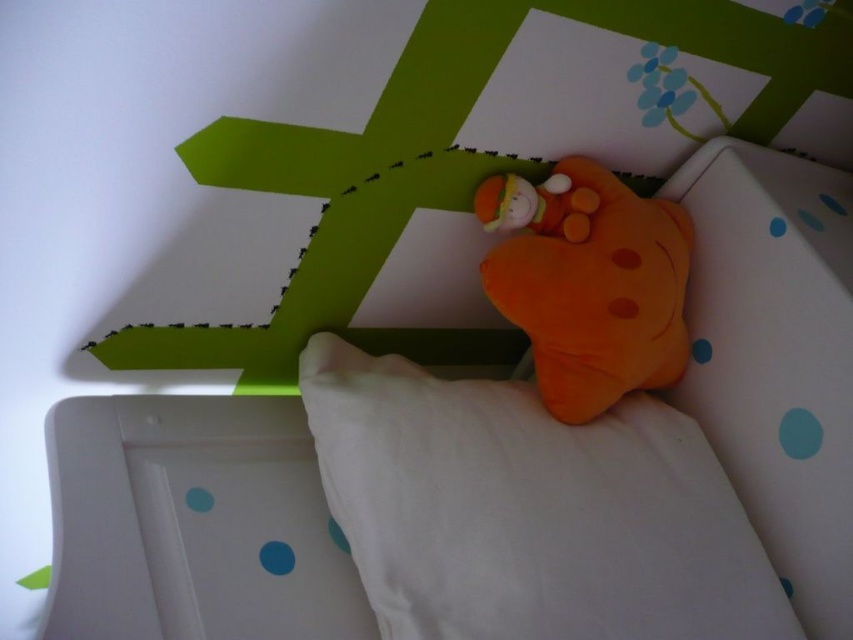
Question: Which point is closer to the camera taking this photo?

Choices:
 (A) (564, 547)
 (B) (509, 179)

Answer: (A)

Question: Can you confirm if white soft pillow at upper center is thinner than fluffy orange plush at upper center?

Choices:
 (A) yes
 (B) no

Answer: (B)

Question: Which point appears closest to the camera in this image?

Choices:
 (A) (665, 316)
 (B) (532, 198)
 (C) (614, 596)

Answer: (C)

Question: Considering the relative positions of orange plush toy at upper center and fluffy orange plush at upper center in the image provided, where is orange plush toy at upper center located with respect to fluffy orange plush at upper center?

Choices:
 (A) below
 (B) above

Answer: (A)

Question: Is orange plush toy at upper center below fluffy orange plush at upper center?

Choices:
 (A) yes
 (B) no

Answer: (A)

Question: Considering the real-world distances, which object is farthest from the orange plush toy at upper center?

Choices:
 (A) white soft pillow at upper center
 (B) fluffy orange plush at upper center

Answer: (A)